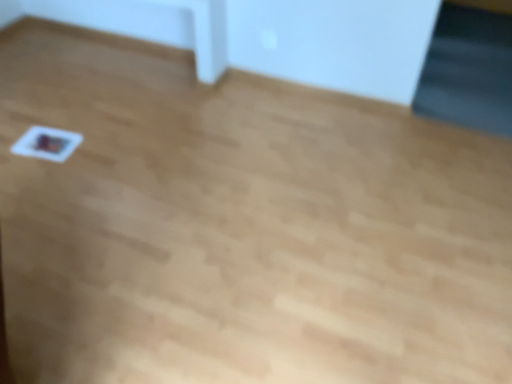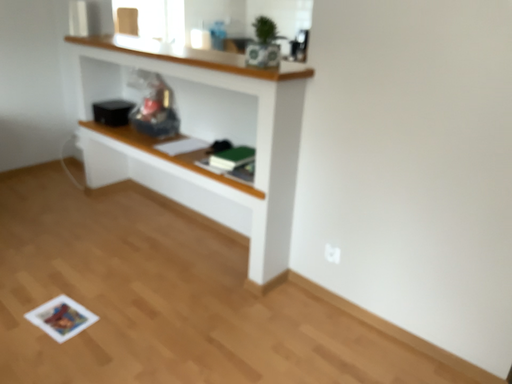
Question: Which way did the camera rotate in the video?

Choices:
 (A) rotated upward
 (B) rotated downward

Answer: (A)